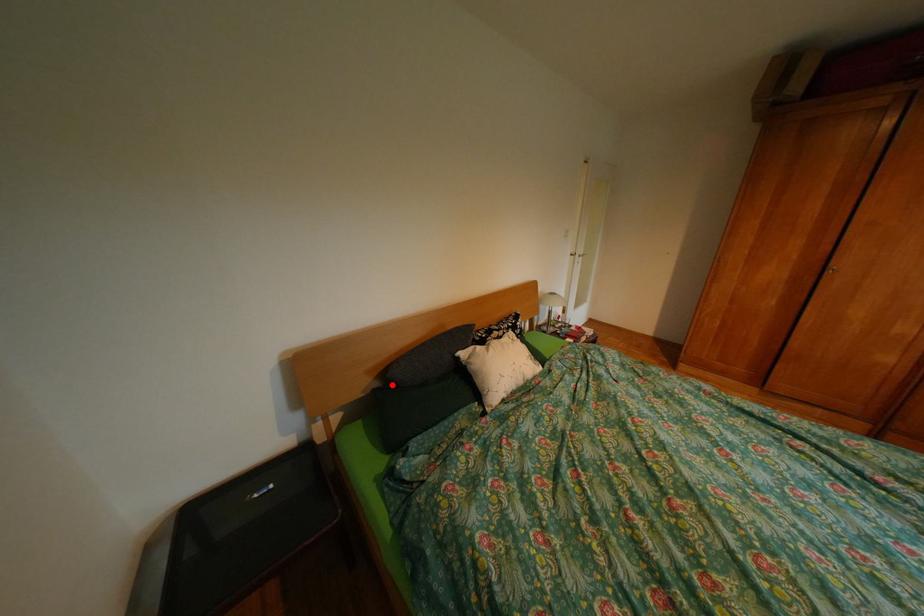
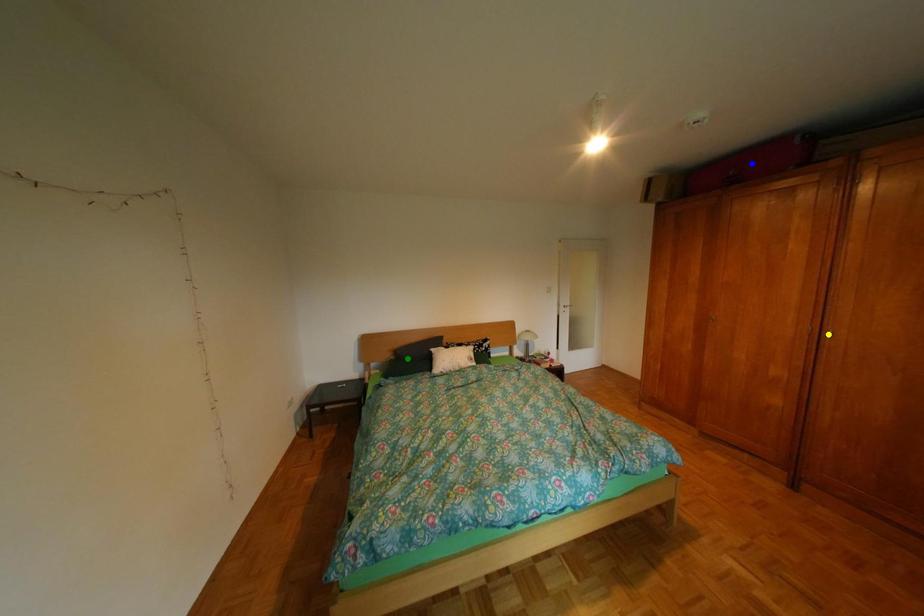
Question: I am providing you with two images of the same scene from different viewpoints. A red point is marked on the first image. You are given multiple points on the second image. Which point in image 2 is actually the same real-world point as the red point in image 1?

Choices:
 (A) yellow point
 (B) green point
 (C) blue point

Answer: (B)